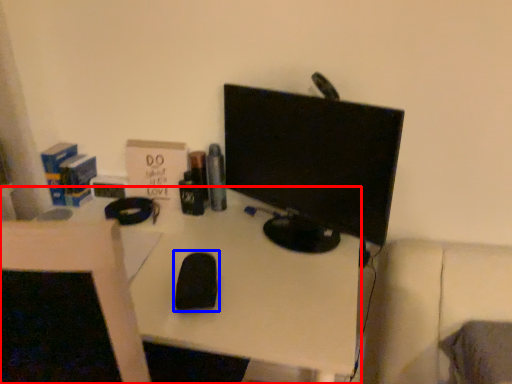
Question: Among these objects, which one is farthest to the camera, desk (highlighted by a red box) or mouse (highlighted by a blue box)?

Choices:
 (A) desk
 (B) mouse

Answer: (B)